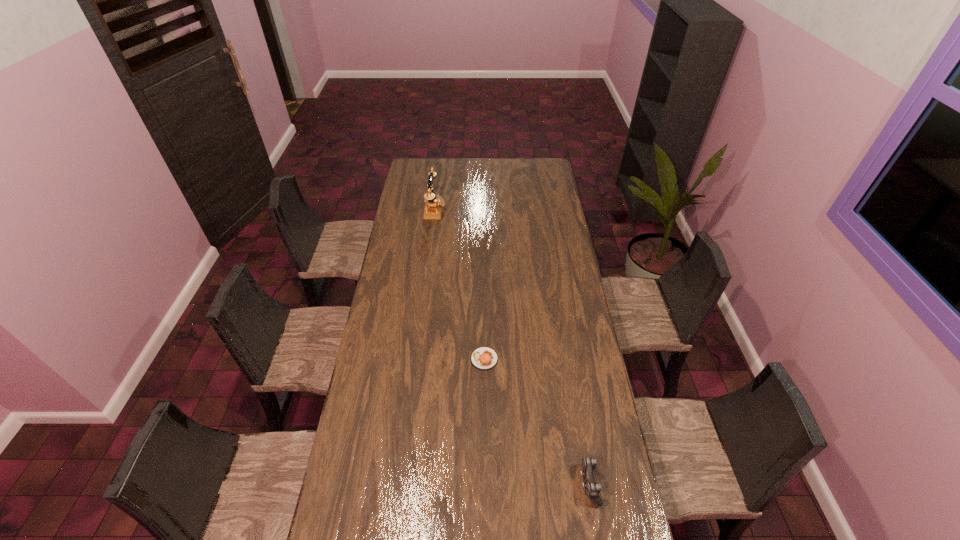
Image resolution: width=960 pixels, height=540 pixels. I want to click on vacant area between the farthest object and the control, so click(x=512, y=347).

Locate an element on the screen. The width and height of the screenshot is (960, 540). free space between the second shortest object and the tallest object is located at coordinates (512, 347).

Locate an element on the screen. unoccupied area between the second object from left to right and the tallest object is located at coordinates (460, 285).

Where is `object that stands as the second closest to the patty`? This screenshot has height=540, width=960. object that stands as the second closest to the patty is located at coordinates (433, 206).

Select which object appears as the second closest to the leftmost object. Please provide its 2D coordinates. Your answer should be formatted as a tuple, i.e. [(x, y)], where the tuple contains the x and y coordinates of a point satisfying the conditions above.

[(592, 488)]

At what (x,y) coordinates should I click in order to perform the action: click on free spot that satisfies the following two spatial constraints: 1. on the dial of the patty; 2. on the left side of the farthest object. Please return your answer as a coordinate pair (x, y). This screenshot has width=960, height=540. Looking at the image, I should click on (417, 359).

Identify the location of free location that satisfies the following two spatial constraints: 1. on the dial of the patty; 2. on the right side of the telephone. (417, 359).

Image resolution: width=960 pixels, height=540 pixels. I want to click on vacant space that satisfies the following two spatial constraints: 1. on the dial of the farthest object; 2. on the left side of the patty, so click(x=417, y=359).